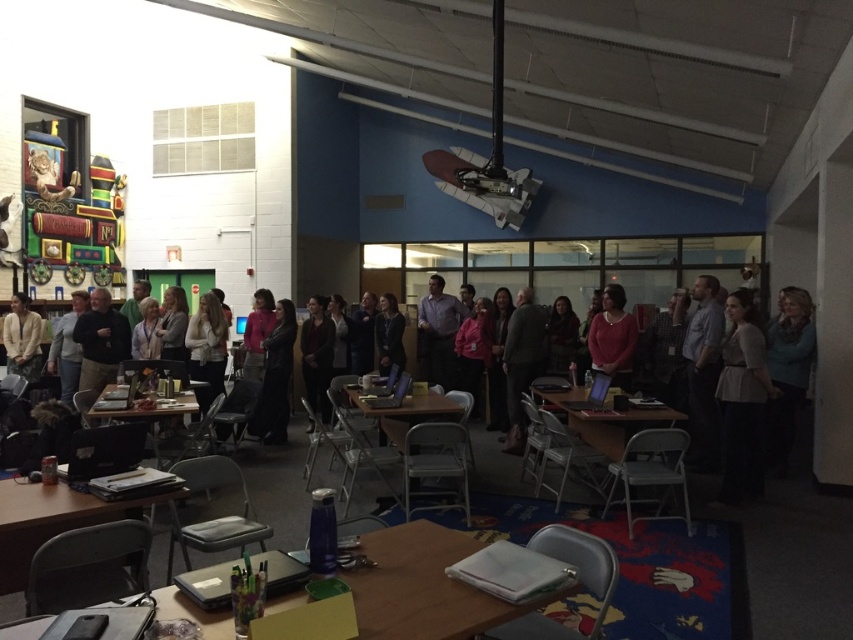
Question: Is light beige sweater at left above dark gray sweater at center?

Choices:
 (A) no
 (B) yes

Answer: (B)

Question: Which of these objects is positioned farthest from the wooden table at lower left?

Choices:
 (A) light beige sweater at left
 (B) pink matte sweater at center
 (C) dark gray sweater at center
 (D) dark brown sweater at center

Answer: (B)

Question: Does dark brown sweater at center have a larger size compared to wooden table at lower left?

Choices:
 (A) yes
 (B) no

Answer: (B)

Question: Estimate the real-world distances between objects in this image. Which object is farther from the dark matte coat at center?

Choices:
 (A) dark gray sweater at center
 (B) wooden table at center
 (C) wooden table at lower left

Answer: (B)

Question: Does dark matte coat at center appear on the left side of pink matte sweater at center?

Choices:
 (A) yes
 (B) no

Answer: (A)

Question: Among these points, which one is farthest from the camera?

Choices:
 (A) (21, 588)
 (B) (412, 422)

Answer: (B)